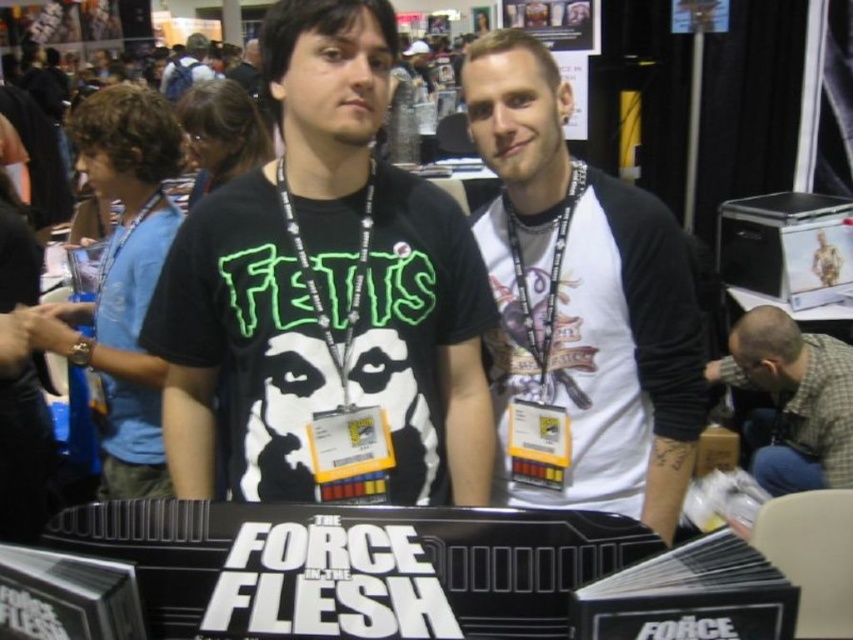
Does point (602, 400) come behind point (196, 61)?

No.

Between white matte t-shirt at center and blue backpack at upper left, which one appears on the right side from the viewer's perspective?

white matte t-shirt at center

Is point (543, 209) farther from camera compared to point (186, 70)?

No, (543, 209) is in front of (186, 70).

At what (x,y) coordinates should I click in order to perform the action: click on white matte t-shirt at center. Please return your answer as a coordinate pair (x, y). The image size is (853, 640). Looking at the image, I should click on (579, 307).

Can you confirm if white matte t-shirt at center is thinner than gray plaid shirt at lower right?

No.

Is point (668, 353) more distant than point (844, 472)?

No.

You are a GUI agent. You are given a task and a screenshot of the screen. Output one action in this format:
    pyautogui.click(x=<x>, y=<y>)
    Task: Click on the white matte t-shirt at center
    
    Given the screenshot: What is the action you would take?
    pyautogui.click(x=579, y=307)

Is black matte t-shirt at center positioned behind gray plaid shirt at lower right?

No, black matte t-shirt at center is in front of gray plaid shirt at lower right.

Based on the photo, which is above, black matte t-shirt at center or gray plaid shirt at lower right?

black matte t-shirt at center is above.

Where is `black matte t-shirt at center`? This screenshot has width=853, height=640. black matte t-shirt at center is located at coordinates (383, 248).